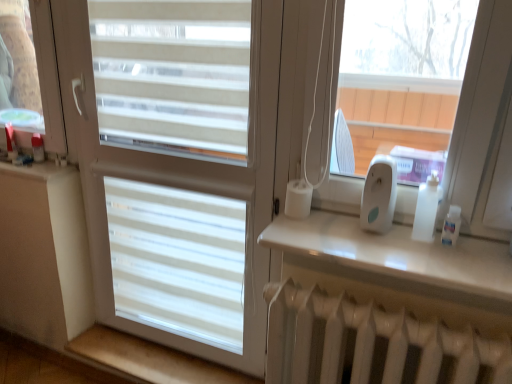
Image resolution: width=512 pixels, height=384 pixels. What do you see at coordinates (398, 259) in the screenshot?
I see `white glossy shelf at upper right, arranged as the 1th window sill when viewed from the right` at bounding box center [398, 259].

The image size is (512, 384). Describe the element at coordinates (176, 164) in the screenshot. I see `white matte window at center` at that location.

The width and height of the screenshot is (512, 384). Identify the location of white glossy shelf at upper right, which ranks as the 1th window sill in top-to-bottom order. (398, 259).

Considering the relative positions of white matte window at center and beige wood at lower left, arranged as the 1th window sill when viewed from the back, in the image provided, is white matte window at center to the right of beige wood at lower left, arranged as the 1th window sill when viewed from the back, from the viewer's perspective?

Indeed, white matte window at center is positioned on the right side of beige wood at lower left, arranged as the 1th window sill when viewed from the back.

Considering the positions of objects white matte window at center and beige wood at lower left, arranged as the 1th window sill when viewed from the back, in the image provided, who is behind, white matte window at center or beige wood at lower left, arranged as the 1th window sill when viewed from the back,?

beige wood at lower left, arranged as the 1th window sill when viewed from the back.

Is white matte window at center inside or outside of beige wood at lower left, which is counted as the second window sill, starting from the front?

white matte window at center cannot be found inside beige wood at lower left, which is counted as the second window sill, starting from the front.

Considering the sizes of objects white plastic ipod at right and beige wood at lower left, the 1th window sill when ordered from left to right, in the image provided, who is thinner, white plastic ipod at right or beige wood at lower left, the 1th window sill when ordered from left to right,?

white plastic ipod at right is thinner.

Considering the sizes of objects white plastic ipod at right and beige wood at lower left, arranged as the 1th window sill when viewed from the back, in the image provided, who is bigger, white plastic ipod at right or beige wood at lower left, arranged as the 1th window sill when viewed from the back,?

Bigger between the two is beige wood at lower left, arranged as the 1th window sill when viewed from the back.

Based on their positions, is white plastic ipod at right located to the left or right of beige wood at lower left, the first window sill ordered from the bottom?

white plastic ipod at right is positioned on beige wood at lower left, the first window sill ordered from the bottom,'s right side.

From a real-world perspective, is white plastic ipod at right positioned over beige wood at lower left, the 1th window sill when ordered from left to right, based on gravity?

Yes.

Is white plastic ipod at right facing towards white matte window at center?

No, white plastic ipod at right does not turn towards white matte window at center.

From the image's perspective, is white plastic ipod at right under white matte window at center?

Incorrect, from the image's perspective, white plastic ipod at right is higher than white matte window at center.

Considering the relative positions of white plastic ipod at right and white matte window at center in the image provided, is white plastic ipod at right to the left of white matte window at center from the viewer's perspective?

No.

From a real-world perspective, is white plastic ipod at right physically located above or below white matte window at center?

white plastic ipod at right is situated higher than white matte window at center in the real world.

Considering the positions of objects beige wood at lower left, arranged as the 1th window sill when viewed from the back, and white glossy shelf at upper right, arranged as the 1th window sill when viewed from the right, in the image provided, who is more to the right, beige wood at lower left, arranged as the 1th window sill when viewed from the back, or white glossy shelf at upper right, arranged as the 1th window sill when viewed from the right,?

From the viewer's perspective, white glossy shelf at upper right, arranged as the 1th window sill when viewed from the right, appears more on the right side.

Does beige wood at lower left, arranged as the 1th window sill when viewed from the back, have a larger size compared to white glossy shelf at upper right, positioned as the second window sill in bottom-to-top order?

Correct, beige wood at lower left, arranged as the 1th window sill when viewed from the back, is larger in size than white glossy shelf at upper right, positioned as the second window sill in bottom-to-top order.

Considering the positions of point (488, 244) and point (224, 382), is point (488, 244) closer or farther from the camera than point (224, 382)?

Point (488, 244) appears to be closer to the viewer than point (224, 382).

Is white glossy shelf at upper right, which ranks as the 1th window sill in front-to-back order, touching beige wood at lower left, which ranks as the 2th window sill in right-to-left order?

white glossy shelf at upper right, which ranks as the 1th window sill in front-to-back order, is not next to beige wood at lower left, which ranks as the 2th window sill in right-to-left order, and they're not touching.

Locate an element on the screen. Image resolution: width=512 pixels, height=384 pixels. window sill above the beige wood at lower left, which is counted as the second window sill, starting from the front (from the image's perspective) is located at coordinates (398, 259).

How different are the orientations of white glossy shelf at upper right, the second window sill from the back, and beige wood at lower left, the first window sill ordered from the bottom, in degrees?

6.82e-05 degrees.

Is white plastic ipod at right not within white glossy shelf at upper right, arranged as the 1th window sill when viewed from the right?

Yes, white plastic ipod at right is outside of white glossy shelf at upper right, arranged as the 1th window sill when viewed from the right.

How different are the orientations of white plastic ipod at right and white glossy shelf at upper right, placed as the second window sill when sorted from left to right, in degrees?

The angle between the facing direction of white plastic ipod at right and the facing direction of white glossy shelf at upper right, placed as the second window sill when sorted from left to right, is 0.0127 degrees.

Is white plastic ipod at right oriented towards white glossy shelf at upper right, the second window sill from the back?

No.

Does white plastic ipod at right have a greater width compared to white glossy shelf at upper right, which ranks as the 1th window sill in top-to-bottom order?

No.

From the picture: From a real-world perspective, between white matte window at center and white glossy shelf at upper right, which ranks as the 1th window sill in top-to-bottom order, who is vertically higher?

From a 3D spatial view, white glossy shelf at upper right, which ranks as the 1th window sill in top-to-bottom order, is above.

How many degrees apart are the facing directions of white matte window at center and white glossy shelf at upper right, the second window sill from the back?

white matte window at center and white glossy shelf at upper right, the second window sill from the back, are facing 0.0126 degrees away from each other.

Does white matte window at center have a larger size compared to white glossy shelf at upper right, arranged as the 1th window sill when viewed from the right?

Yes.

At what (x,y) coordinates should I click in order to perform the action: click on window sill below the white matte window at center (from a real-world perspective). Please return your answer as a coordinate pair (x, y). Looking at the image, I should click on (151, 359).

This screenshot has height=384, width=512. What are the coordinates of `window sill that is the 2nd object to the left of the white plastic ipod at right, starting at the anchor` in the screenshot? It's located at (151, 359).

Estimate the real-world distances between objects in this image. Which object is closer to white plastic ipod at right, white glossy shelf at upper right, which ranks as the 1th window sill in front-to-back order, or white matte window at center?

The object closer to white plastic ipod at right is white glossy shelf at upper right, which ranks as the 1th window sill in front-to-back order.

Estimate the real-world distances between objects in this image. Which object is closer to white matte window at center, white plastic ipod at right or beige wood at lower left, arranged as the 1th window sill when viewed from the back?

Based on the image, beige wood at lower left, arranged as the 1th window sill when viewed from the back, appears to be nearer to white matte window at center.

Consider the image. From the image, which object appears to be farther from white glossy shelf at upper right, arranged as the 1th window sill when viewed from the right, white matte window at center or beige wood at lower left, the second window sill from the top?

beige wood at lower left, the second window sill from the top.

When comparing their distances from white plastic ipod at right, does white matte window at center or white glossy shelf at upper right, which ranks as the 1th window sill in top-to-bottom order, seem further?

white matte window at center is positioned further to the anchor white plastic ipod at right.

When comparing their distances from white matte window at center, does white glossy shelf at upper right, which ranks as the 1th window sill in front-to-back order, or white plastic ipod at right seem further?

The object further to white matte window at center is white plastic ipod at right.

Which object lies further to the anchor point beige wood at lower left, the second window sill from the top, white plastic ipod at right or white glossy shelf at upper right, which ranks as the 1th window sill in top-to-bottom order?

Among the two, white plastic ipod at right is located further to beige wood at lower left, the second window sill from the top.

When comparing their distances from white matte window at center, does beige wood at lower left, the first window sill ordered from the bottom, or white plastic ipod at right seem closer?

Based on the image, beige wood at lower left, the first window sill ordered from the bottom, appears to be nearer to white matte window at center.

Considering their positions, is white glossy shelf at upper right, which ranks as the 1th window sill in front-to-back order, positioned further to white plastic ipod at right than beige wood at lower left, which ranks as the 2th window sill in right-to-left order?

beige wood at lower left, which ranks as the 2th window sill in right-to-left order, is positioned further to the anchor white plastic ipod at right.

The image size is (512, 384). Find the location of `window sill between beige wood at lower left, arranged as the 1th window sill when viewed from the back, and white plastic ipod at right`. window sill between beige wood at lower left, arranged as the 1th window sill when viewed from the back, and white plastic ipod at right is located at coordinates (398, 259).

The image size is (512, 384). I want to click on window between beige wood at lower left, the second window sill from the top, and white plastic ipod at right, so click(x=176, y=164).

This screenshot has height=384, width=512. I want to click on window situated between beige wood at lower left, arranged as the 1th window sill when viewed from the back, and white glossy shelf at upper right, arranged as the 1th window sill when viewed from the right, from left to right, so click(176, 164).

I want to click on window sill situated between white matte window at center and white plastic ipod at right from left to right, so click(398, 259).